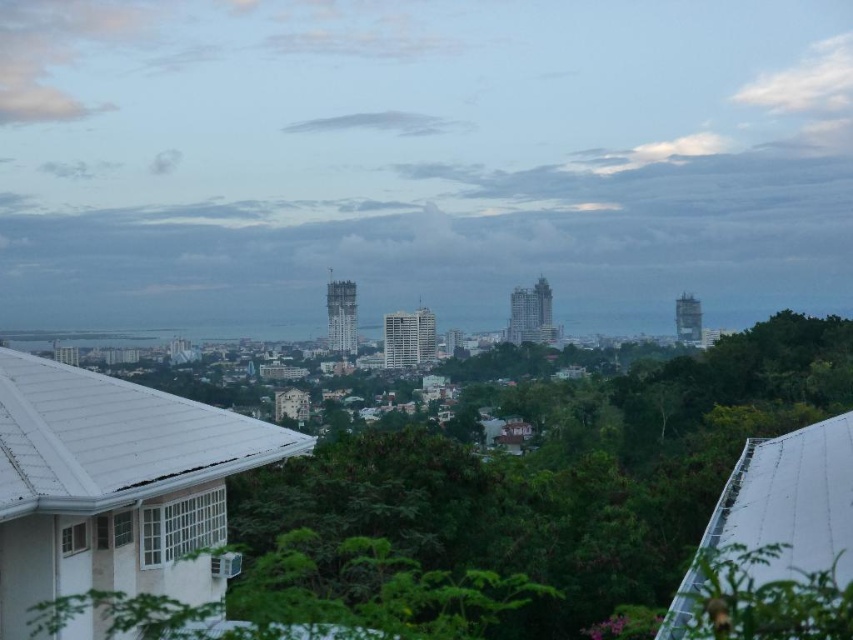
Question: Is smooth concrete skyline at center below green leafy tree at lower center?

Choices:
 (A) no
 (B) yes

Answer: (A)

Question: Which point is farther to the camera?

Choices:
 (A) (758, 81)
 (B) (799, 420)

Answer: (A)

Question: Can you confirm if smooth concrete skyline at center is positioned above green leafy tree at lower center?

Choices:
 (A) no
 (B) yes

Answer: (B)

Question: Can you confirm if smooth concrete skyline at center is positioned below green leafy tree at lower center?

Choices:
 (A) no
 (B) yes

Answer: (A)

Question: Which point is closer to the camera?

Choices:
 (A) smooth concrete skyline at center
 (B) green leafy tree at lower center

Answer: (B)